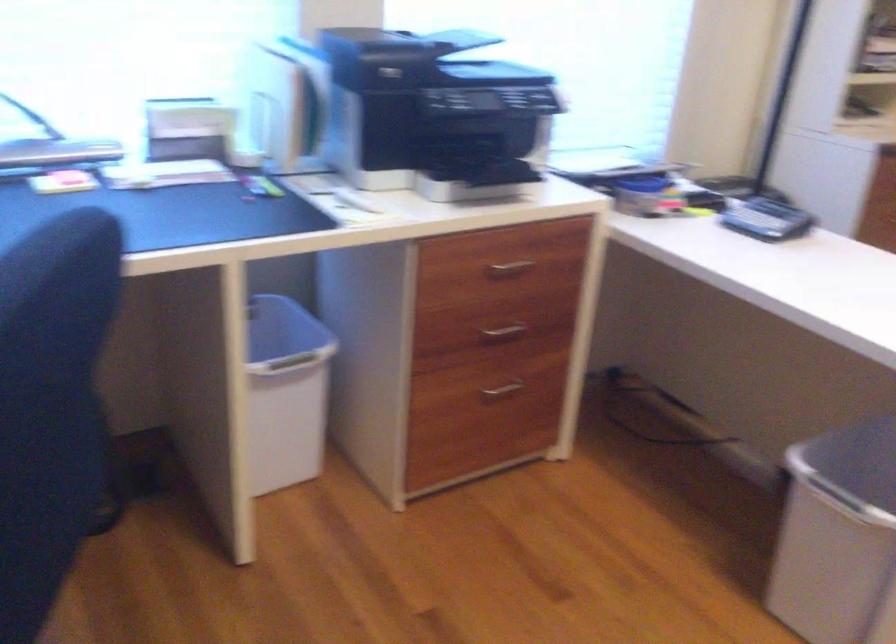
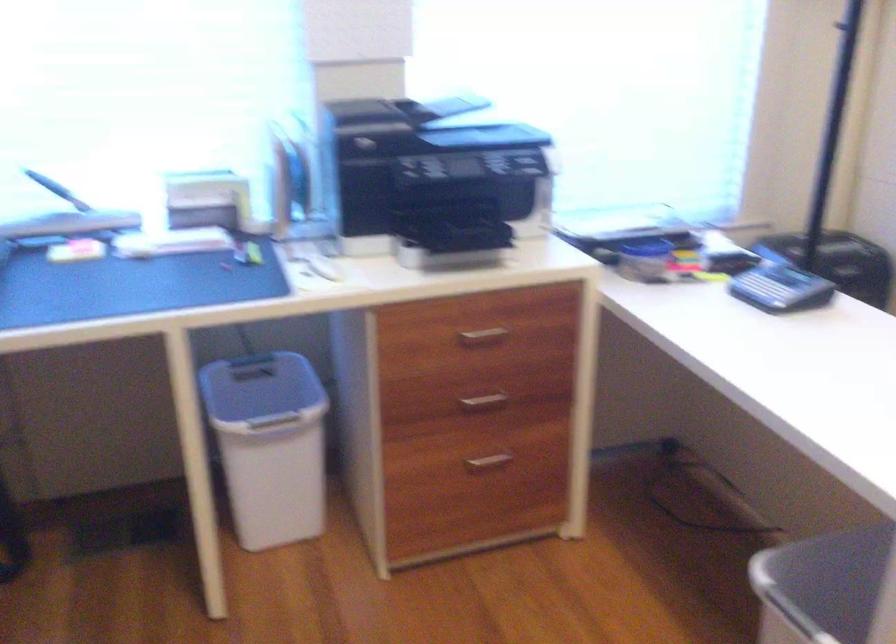
Where in the second image is the point corresponding to point 498,330 from the first image?

(484, 401)